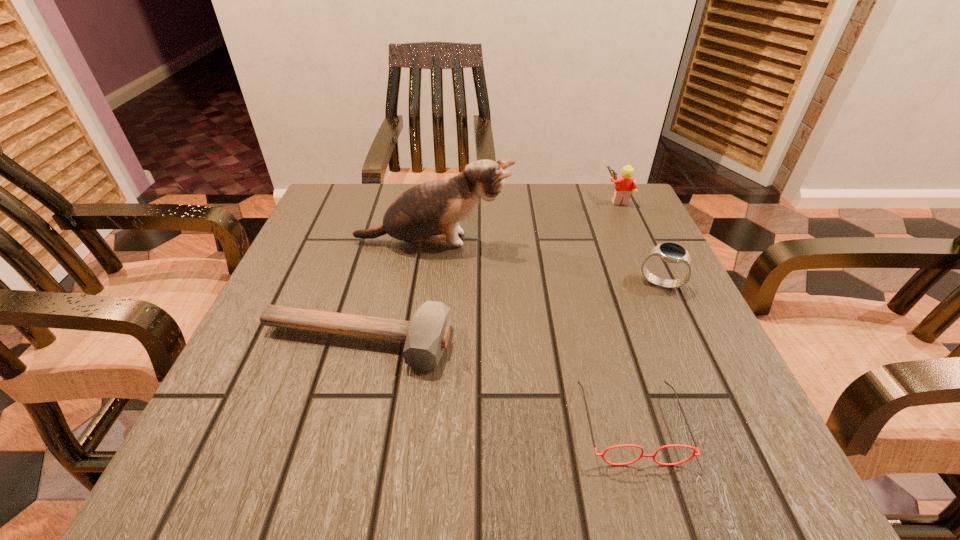
The width and height of the screenshot is (960, 540). Find the location of `Lego at the right edge`. Lego at the right edge is located at coordinates (625, 184).

Identify the location of watch that is at the right edge. The image size is (960, 540). (670, 252).

The width and height of the screenshot is (960, 540). I want to click on spectacles at the right edge, so click(627, 445).

In order to click on object at the far left corner in this screenshot , I will do `click(430, 212)`.

Locate an element on the screen. This screenshot has width=960, height=540. object present at the far right corner is located at coordinates (625, 184).

This screenshot has width=960, height=540. I want to click on object that is at the near right corner, so click(627, 445).

The image size is (960, 540). In the image, there is a desktop. Find the location of `vacant space at the far edge`. vacant space at the far edge is located at coordinates (552, 184).

At what (x,y) coordinates should I click in order to perform the action: click on vacant space at the near edge of the desktop. Please return your answer as a coordinate pair (x, y). Image resolution: width=960 pixels, height=540 pixels. Looking at the image, I should click on (448, 450).

This screenshot has height=540, width=960. Identify the location of vacant space at the left edge of the desktop. (284, 346).

Where is `vacant area at the right edge`? vacant area at the right edge is located at coordinates click(632, 270).